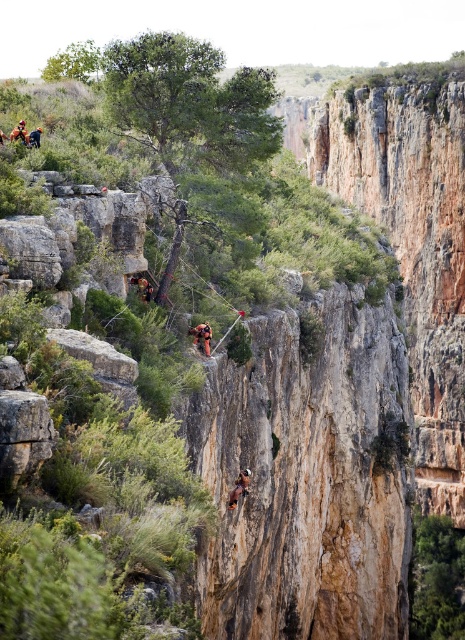
Is the position of camouflage fabric person at center more distant than that of orange fabric harness at upper left?

No, it is in front of orange fabric harness at upper left.

Between point (245, 493) and point (28, 145), which one is positioned behind?

The point (245, 493) is more distant.

Where is `camouflage fabric person at center`? camouflage fabric person at center is located at coordinates (x=239, y=488).

Is camouflage fabric person at center taller than camouflage fabric harness at center?

Yes.

Can you confirm if camouflage fabric person at center is smaller than camouflage fabric harness at center?

Actually, camouflage fabric person at center might be larger than camouflage fabric harness at center.

What do you see at coordinates (239, 488) in the screenshot? Image resolution: width=465 pixels, height=640 pixels. I see `camouflage fabric person at center` at bounding box center [239, 488].

Identify the location of camouflage fabric person at center. This screenshot has width=465, height=640. (239, 488).

Between camouflage fabric harness at center and orange fabric harness at upper left, which one has more height?

camouflage fabric harness at center

Does point (192, 332) lie in front of point (30, 141)?

Yes, it is.

Measure the distance between point [208,332] and camera.

The distance of point [208,332] from camera is 50.97 meters.

Locate an element on the screen. camouflage fabric harness at center is located at coordinates (201, 336).